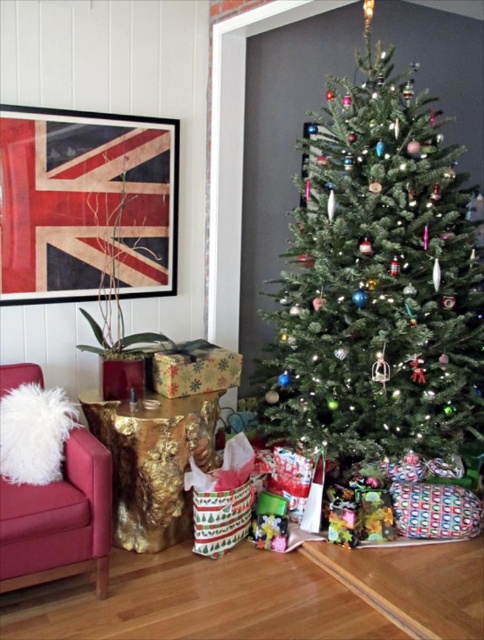
You are a guest entering the room and want to sit on the velvet red armchair at lower left. Can you sit there without moving the green matte christmas tree at center first?

The green matte christmas tree at center is positioned over velvet red armchair at lower left, so you need to move the green matte christmas tree at center first before sitting on the velvet red armchair at lower left.

Based on the photo, you are standing in the Christmas scene and want to determine which of the two points, point (390,65) or point (155,364), is closer to you. Based on the scene description, which point is nearer?

Point (390,65) is closer to the camera than point (155,364), so it is the nearer one.

You are standing in the room and want to place a small decoration on the point closer to you between point (40, 376) and point (233, 380). Which point should you choose?

Point (40, 376) is in front of point (233, 380), so you should choose point (40, 376) as it is closer to you.